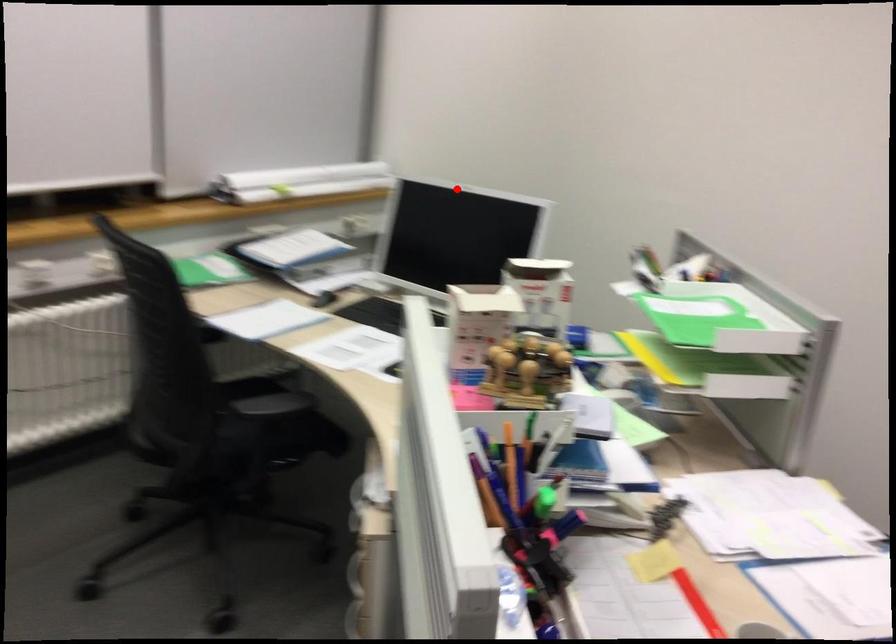
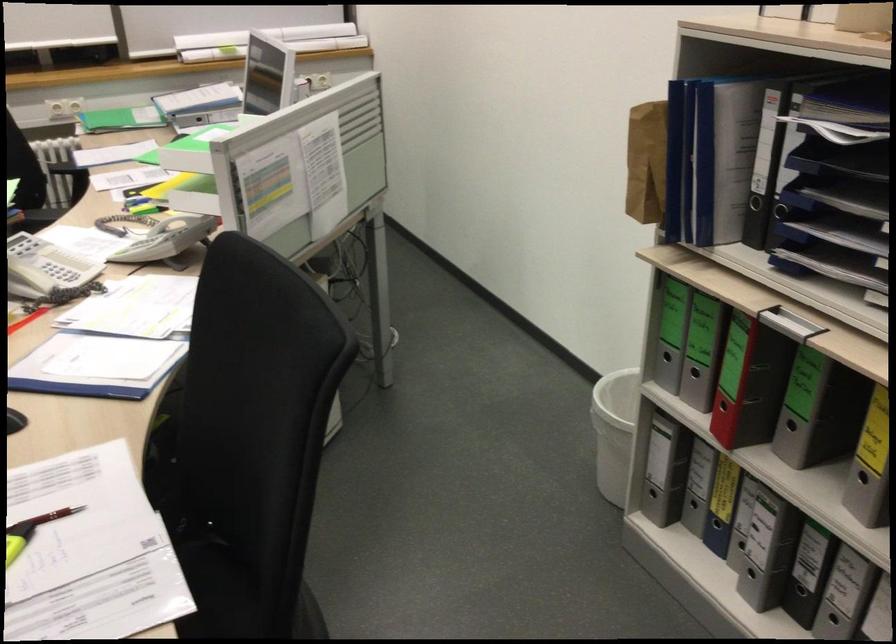
Question: I am providing you with two images of the same scene from different viewpoints. In image1, a red point is highlighted. Considering the same 3D point in image2, which of the following is correct?

Choices:
 (A) It is closer
 (B) It is farther

Answer: (B)